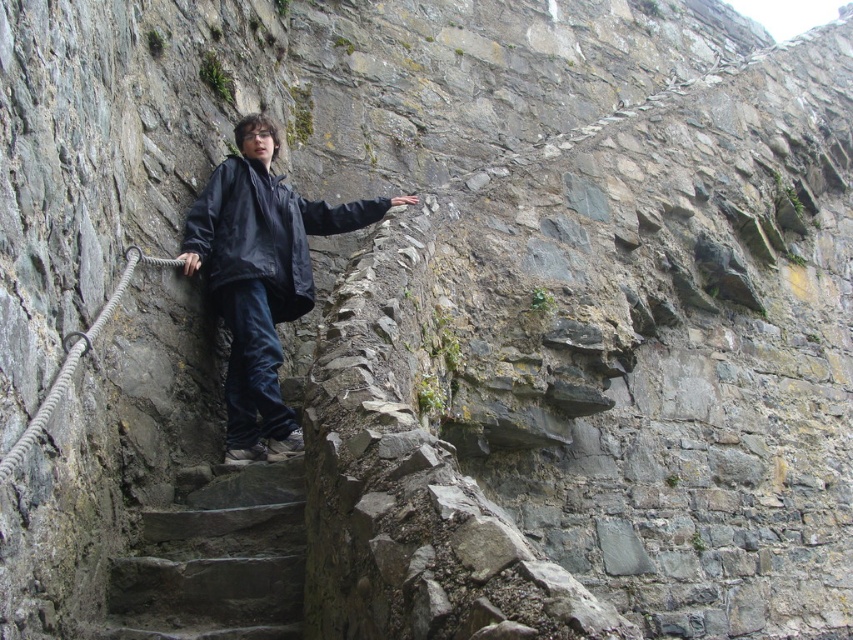
You are standing at the base of the staircase in the image. You want to locate the dark blue jacket at center. Where should you look relative to the point marked at coordinates point (260, 278)?

The dark blue jacket at center is located exactly at point (260, 278), so you should look directly at that point to find it.

You are standing on the narrow stone staircase of an ancient fortress. You notice two points marked on the wall. The first point is at coordinates point (281, 554) and the second is at point (268, 253). If you are facing up the staircase, which point is closer to you?

Point (281, 554) is in front of point (268, 253), so if you are facing up the staircase, the point at (281, 554) is closer to you.